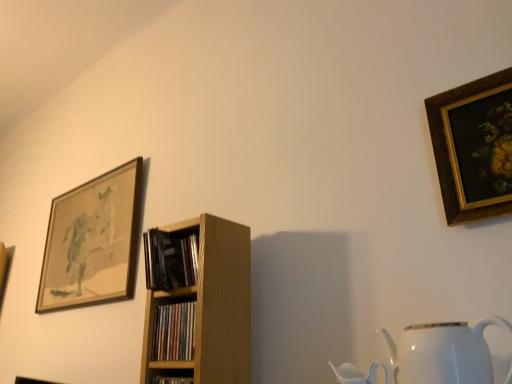
What do you see at coordinates (92, 242) in the screenshot?
I see `wooden framed artwork at upper left, which is the first picture frame in back-to-front order` at bounding box center [92, 242].

Image resolution: width=512 pixels, height=384 pixels. Describe the element at coordinates (170, 259) in the screenshot. I see `wooden bookshelf at center, placed as the 1th book when sorted from top to bottom` at that location.

The width and height of the screenshot is (512, 384). What do you see at coordinates (174, 332) in the screenshot? I see `wooden bookshelf at center, positioned as the second book in top-to-bottom order` at bounding box center [174, 332].

This screenshot has height=384, width=512. I want to click on gold-framed painting at upper right, acting as the 1th picture frame starting from the right, so click(474, 147).

What is the approximate height of wooden shelf at center?

The height of wooden shelf at center is 14.04 centimeters.

The image size is (512, 384). Find the location of `wooden framed artwork at upper left, marked as the 2th picture frame in a front-to-back arrangement`. wooden framed artwork at upper left, marked as the 2th picture frame in a front-to-back arrangement is located at coordinates (92, 242).

From a real-world perspective, relative to wooden framed artwork at upper left, which is the first picture frame in back-to-front order, is wooden shelf at center vertically above or below?

From a real-world perspective, wooden shelf at center is physically below wooden framed artwork at upper left, which is the first picture frame in back-to-front order.

Between wooden shelf at center and wooden framed artwork at upper left, which is the first picture frame in back-to-front order, which one has smaller size?

wooden shelf at center.

Which point is more distant from viewer, (152, 383) or (96, 244)?

The point (96, 244) is behind.

Which is more to the left, wooden shelf at center or wooden framed artwork at upper left, which is the first picture frame in back-to-front order?

wooden framed artwork at upper left, which is the first picture frame in back-to-front order, is more to the left.

Is wooden bookshelf at center, placed as the 1th book when sorted from top to bottom, closer to camera compared to wooden shelf at center?

No, wooden bookshelf at center, placed as the 1th book when sorted from top to bottom, is further to the viewer.

Is wooden bookshelf at center, marked as the second book in a bottom-to-top arrangement, facing away from wooden shelf at center?

No.

How far apart are wooden bookshelf at center, marked as the second book in a bottom-to-top arrangement, and wooden shelf at center?

wooden bookshelf at center, marked as the second book in a bottom-to-top arrangement, is 24.76 centimeters away from wooden shelf at center.

Is wooden bookshelf at center, placed as the 1th book when sorted from top to bottom, inside or outside of wooden shelf at center?

wooden bookshelf at center, placed as the 1th book when sorted from top to bottom, exists outside the volume of wooden shelf at center.

Do you think wooden framed artwork at upper left, which is the first picture frame in back-to-front order, is within wooden bookshelf at center, marked as the second book in a bottom-to-top arrangement, or outside of it?

wooden framed artwork at upper left, which is the first picture frame in back-to-front order, is located beyond the bounds of wooden bookshelf at center, marked as the second book in a bottom-to-top arrangement.

Is wooden framed artwork at upper left, marked as the 2th picture frame in a front-to-back arrangement, beside wooden bookshelf at center, marked as the second book in a bottom-to-top arrangement?

No.

Considering the sizes of wooden framed artwork at upper left, marked as the 2th picture frame in a front-to-back arrangement, and wooden bookshelf at center, marked as the second book in a bottom-to-top arrangement, in the image, is wooden framed artwork at upper left, marked as the 2th picture frame in a front-to-back arrangement, wider or thinner than wooden bookshelf at center, marked as the second book in a bottom-to-top arrangement,?

In the image, wooden framed artwork at upper left, marked as the 2th picture frame in a front-to-back arrangement, appears to be more narrow than wooden bookshelf at center, marked as the second book in a bottom-to-top arrangement.

Is wooden framed artwork at upper left, which is the first picture frame in back-to-front order, aimed at wooden bookshelf at center, placed as the 1th book when sorted from top to bottom?

No, wooden framed artwork at upper left, which is the first picture frame in back-to-front order, does not turn towards wooden bookshelf at center, placed as the 1th book when sorted from top to bottom.

How different are the orientations of wooden bookshelf at center, positioned as the second book in top-to-bottom order, and wooden bookshelf at center, placed as the 1th book when sorted from top to bottom, in degrees?

0.00109 degrees separate the facing orientations of wooden bookshelf at center, positioned as the second book in top-to-bottom order, and wooden bookshelf at center, placed as the 1th book when sorted from top to bottom.

Measure the distance between wooden bookshelf at center, positioned as the second book in top-to-bottom order, and wooden bookshelf at center, placed as the 1th book when sorted from top to bottom.

wooden bookshelf at center, positioned as the second book in top-to-bottom order, and wooden bookshelf at center, placed as the 1th book when sorted from top to bottom, are 4.45 inches apart from each other.

Which is more to the left, wooden bookshelf at center, acting as the first book starting from the bottom, or wooden bookshelf at center, placed as the 1th book when sorted from top to bottom?

wooden bookshelf at center, acting as the first book starting from the bottom.

Which of these two, wooden bookshelf at center, acting as the first book starting from the bottom, or wooden bookshelf at center, placed as the 1th book when sorted from top to bottom, is wider?

wooden bookshelf at center, placed as the 1th book when sorted from top to bottom, is wider.

Looking at this image, is wooden bookshelf at center, positioned as the second book in top-to-bottom order, surrounded by wooden bookshelf at center, placed as the 1th book when sorted from top to bottom?

That's incorrect, wooden bookshelf at center, positioned as the second book in top-to-bottom order, is not inside wooden bookshelf at center, placed as the 1th book when sorted from top to bottom.

Is wooden bookshelf at center, marked as the second book in a bottom-to-top arrangement, wider or thinner than wooden bookshelf at center, acting as the first book starting from the bottom?

wooden bookshelf at center, marked as the second book in a bottom-to-top arrangement, is wider than wooden bookshelf at center, acting as the first book starting from the bottom.

Is wooden bookshelf at center, marked as the second book in a bottom-to-top arrangement, next to wooden bookshelf at center, acting as the first book starting from the bottom, and touching it?

No, wooden bookshelf at center, marked as the second book in a bottom-to-top arrangement, is not in contact with wooden bookshelf at center, acting as the first book starting from the bottom.

Between wooden bookshelf at center, placed as the 1th book when sorted from top to bottom, and wooden bookshelf at center, positioned as the second book in top-to-bottom order, which one has less height?

wooden bookshelf at center, positioned as the second book in top-to-bottom order.

Based on the photo, between wooden shelf at center and white glossy jug at lower right, which one is positioned behind?

wooden shelf at center is more distant.

Considering the relative sizes of wooden shelf at center and white glossy jug at lower right in the image provided, is wooden shelf at center bigger than white glossy jug at lower right?

Incorrect, wooden shelf at center is not larger than white glossy jug at lower right.

From a real-world perspective, is wooden shelf at center on top of white glossy jug at lower right?

No, from a real-world perspective, wooden shelf at center is not on top of white glossy jug at lower right.

Is wooden shelf at center facing away from white glossy jug at lower right?

wooden shelf at center is not turned away from white glossy jug at lower right.

From a real-world perspective, is wooden bookshelf at center, marked as the second book in a bottom-to-top arrangement, over wooden framed artwork at upper left, marked as the 2th picture frame in a front-to-back arrangement?

Actually, wooden bookshelf at center, marked as the second book in a bottom-to-top arrangement, is physically below wooden framed artwork at upper left, marked as the 2th picture frame in a front-to-back arrangement, in the real world.

In the scene shown: Does wooden bookshelf at center, placed as the 1th book when sorted from top to bottom, have a greater height compared to wooden framed artwork at upper left, which is the first picture frame in back-to-front order?

In fact, wooden bookshelf at center, placed as the 1th book when sorted from top to bottom, may be shorter than wooden framed artwork at upper left, which is the first picture frame in back-to-front order.

Are wooden bookshelf at center, placed as the 1th book when sorted from top to bottom, and wooden framed artwork at upper left, the 1th picture frame from the left, making contact?

There is a gap between wooden bookshelf at center, placed as the 1th book when sorted from top to bottom, and wooden framed artwork at upper left, the 1th picture frame from the left.

Could you tell me if wooden bookshelf at center, marked as the second book in a bottom-to-top arrangement, is facing wooden framed artwork at upper left, which is the first picture frame in back-to-front order?

No.

Where is `shelf in front of the wooden framed artwork at upper left, the 1th picture frame from the left`? The height and width of the screenshot is (384, 512). shelf in front of the wooden framed artwork at upper left, the 1th picture frame from the left is located at coordinates (172, 376).

The image size is (512, 384). What are the coordinates of `book on the right of the wooden shelf at center` in the screenshot? It's located at (170, 259).

Based on their spatial positions, is wooden framed artwork at upper left, the second picture frame viewed from the right, or gold-framed painting at upper right, arranged as the 2th picture frame when viewed from the left, further from wooden shelf at center?

wooden framed artwork at upper left, the second picture frame viewed from the right, is positioned further to the anchor wooden shelf at center.

Which object lies nearer to the anchor point wooden bookshelf at center, placed as the 1th book when sorted from top to bottom, gold-framed painting at upper right, which is the 2th picture frame in back-to-front order, or wooden shelf at center?

Based on the image, wooden shelf at center appears to be nearer to wooden bookshelf at center, placed as the 1th book when sorted from top to bottom.

From the image, which object appears to be nearer to wooden shelf at center, gold-framed painting at upper right, the 1th picture frame positioned from the front, or white glossy jug at lower right?

The object closer to wooden shelf at center is white glossy jug at lower right.

Based on the photo, when comparing their distances from white glossy jug at lower right, does gold-framed painting at upper right, the 1th picture frame positioned from the front, or wooden framed artwork at upper left, the second picture frame viewed from the right, seem further?

wooden framed artwork at upper left, the second picture frame viewed from the right, is further to white glossy jug at lower right.

Consider the image. Which object lies further to the anchor point wooden shelf at center, white glossy jug at lower right or wooden bookshelf at center, positioned as the second book in top-to-bottom order?

white glossy jug at lower right lies further to wooden shelf at center than the other object.

When comparing their distances from white glossy jug at lower right, does wooden bookshelf at center, placed as the 1th book when sorted from top to bottom, or wooden bookshelf at center, positioned as the second book in top-to-bottom order, seem closer?

wooden bookshelf at center, positioned as the second book in top-to-bottom order, lies closer to white glossy jug at lower right than the other object.

When comparing their distances from wooden bookshelf at center, placed as the 1th book when sorted from top to bottom, does wooden bookshelf at center, acting as the first book starting from the bottom, or gold-framed painting at upper right, arranged as the 2th picture frame when viewed from the left, seem closer?

wooden bookshelf at center, acting as the first book starting from the bottom, is positioned closer to the anchor wooden bookshelf at center, placed as the 1th book when sorted from top to bottom.

Which object lies nearer to the anchor point wooden framed artwork at upper left, marked as the 2th picture frame in a front-to-back arrangement, wooden shelf at center or wooden bookshelf at center, marked as the second book in a bottom-to-top arrangement?

wooden bookshelf at center, marked as the second book in a bottom-to-top arrangement, lies closer to wooden framed artwork at upper left, marked as the 2th picture frame in a front-to-back arrangement, than the other object.

Where is `book situated between wooden framed artwork at upper left, the second picture frame viewed from the right, and wooden bookshelf at center, placed as the 1th book when sorted from top to bottom, from left to right`? book situated between wooden framed artwork at upper left, the second picture frame viewed from the right, and wooden bookshelf at center, placed as the 1th book when sorted from top to bottom, from left to right is located at coordinates (174, 332).

At what (x,y) coordinates should I click in order to perform the action: click on shelf between wooden bookshelf at center, acting as the first book starting from the bottom, and white glossy jug at lower right. Please return your answer as a coordinate pair (x, y). This screenshot has height=384, width=512. Looking at the image, I should click on (172, 376).

Locate an element on the screen. This screenshot has width=512, height=384. jug located between wooden shelf at center and gold-framed painting at upper right, acting as the 1th picture frame starting from the right, in the left-right direction is located at coordinates (442, 353).

Find the location of a particular element. This screenshot has width=512, height=384. shelf between wooden framed artwork at upper left, the second picture frame viewed from the right, and white glossy jug at lower right, in the horizontal direction is located at coordinates (172, 376).